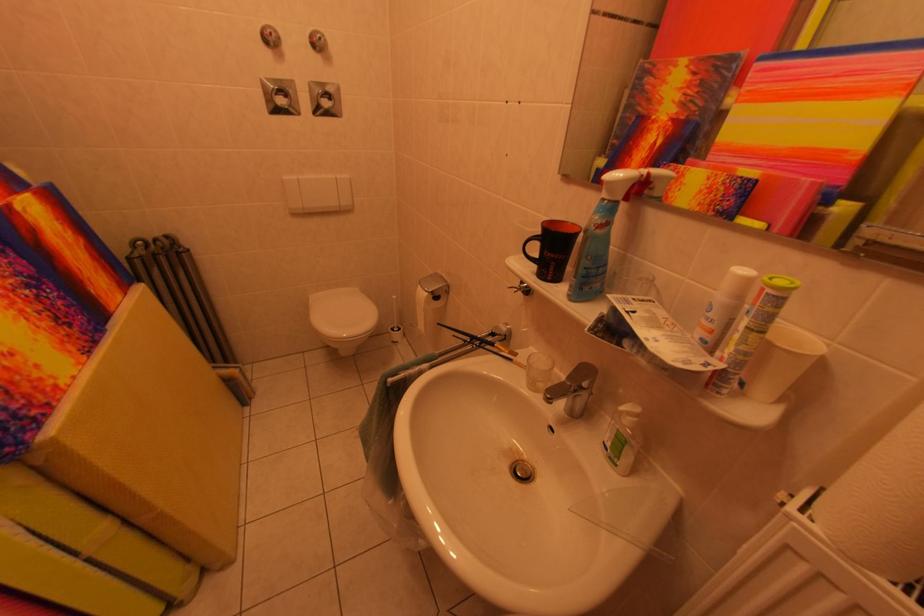
Find where to pull the spray bottle trigger. Please return your answer as a coordinate pair (x, y).

(630, 191)